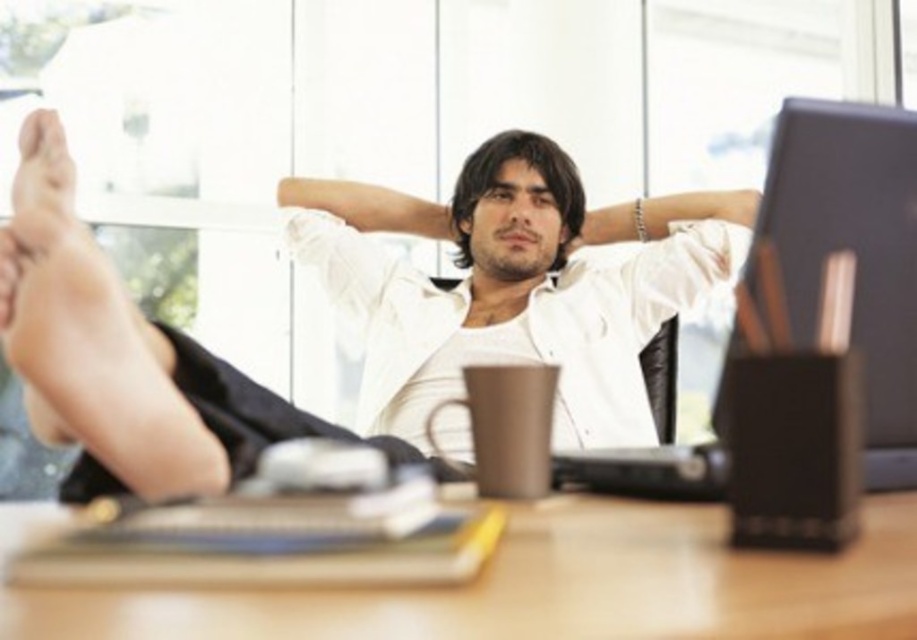
Between wooden table at center and matte black monitor at right, which one has more height?

Standing taller between the two is matte black monitor at right.

Is wooden table at center taller than matte black monitor at right?

In fact, wooden table at center may be shorter than matte black monitor at right.

The width and height of the screenshot is (917, 640). Describe the element at coordinates (550, 586) in the screenshot. I see `wooden table at center` at that location.

I want to click on wooden table at center, so click(550, 586).

Is white matte shirt at center wider than matte black monitor at right?

Yes.

Is point (95, 262) positioned in front of point (722, 424)?

Yes, it is in front of point (722, 424).

Identify the location of white matte shirt at center. (514, 284).

Who is shorter, white matte shirt at center or wooden table at center?

Standing shorter between the two is wooden table at center.

The height and width of the screenshot is (640, 917). Identify the location of white matte shirt at center. (514, 284).

Who is more distant from viewer, [665,276] or [912,609]?

Point [665,276]

The height and width of the screenshot is (640, 917). I want to click on white matte shirt at center, so point(514,284).